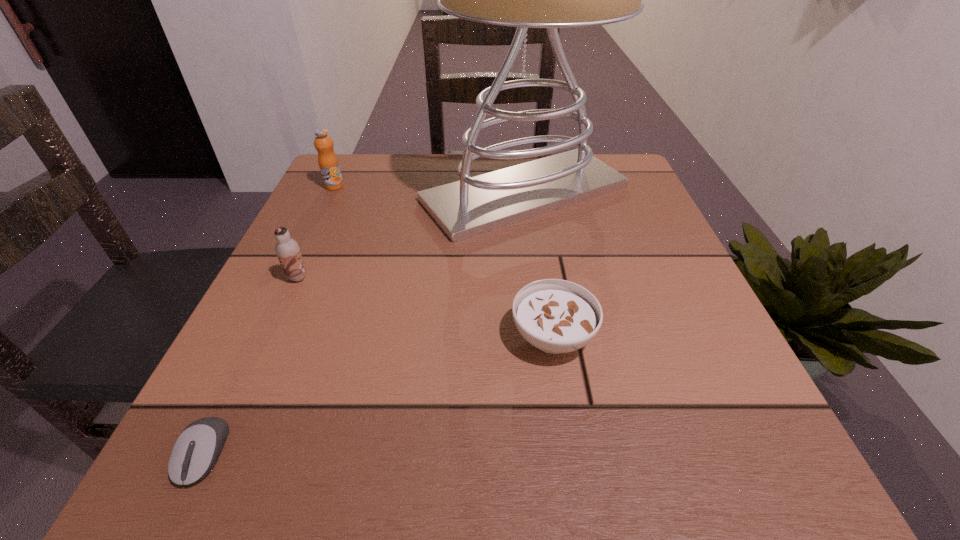
You are a GUI agent. You are given a task and a screenshot of the screen. Output one action in this format:
    pyautogui.click(x=<x>, y=<y>)
    Task: Click on the object located at the near left corner
    
    Given the screenshot: What is the action you would take?
    pyautogui.click(x=195, y=452)

The width and height of the screenshot is (960, 540). Identify the location of object positioned at the far right corner. (474, 205).

The image size is (960, 540). I want to click on blank space at the far edge, so click(x=488, y=159).

The image size is (960, 540). Find the location of `free space at the near edge of the desktop`. free space at the near edge of the desktop is located at coordinates 441,487.

You are a GUI agent. You are given a task and a screenshot of the screen. Output one action in this format:
    pyautogui.click(x=<x>, y=<y>)
    Task: Click on the free space at the left edge
    
    Given the screenshot: What is the action you would take?
    pyautogui.click(x=326, y=321)

The image size is (960, 540). In the image, there is a desktop. In order to click on vacant region at the right edge in this screenshot , I will do `click(665, 237)`.

Locate an element on the screen. The height and width of the screenshot is (540, 960). free region at the far right corner is located at coordinates (636, 195).

Locate an element on the screen. free point between the soup bowl and the shortest object is located at coordinates (378, 395).

This screenshot has width=960, height=540. In order to click on empty location between the third farthest object and the tallest object in this screenshot , I will do `click(411, 235)`.

At what (x,y) coordinates should I click in order to perform the action: click on free space that is in between the fourth shortest object and the chocolate milk. Please return your answer as a coordinate pair (x, y). Looking at the image, I should click on (316, 232).